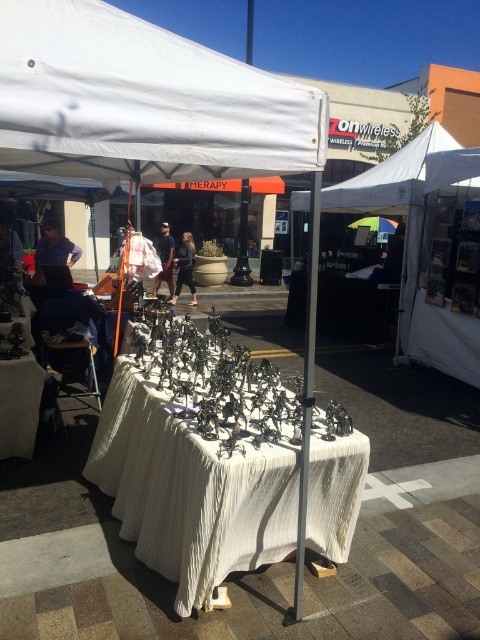
Question: From the image, what is the correct spatial relationship of metallic silver figurines at center in relation to dark gray pants at center?

Choices:
 (A) right
 (B) left

Answer: (A)

Question: Does white fabric tent at upper center come in front of matte blue shirt at left?

Choices:
 (A) no
 (B) yes

Answer: (B)

Question: Considering the relative positions of matte blue shirt at left and dark blue jeans at center in the image provided, where is matte blue shirt at left located with respect to dark blue jeans at center?

Choices:
 (A) right
 (B) left

Answer: (B)

Question: Which point is farther to the camera?

Choices:
 (A) white fabric tent at upper center
 (B) dark blue jeans at center
 (C) white fabric canopy at upper center

Answer: (B)

Question: Which point appears farthest from the camera in this image?

Choices:
 (A) (177, 298)
 (B) (168, 227)
 (C) (417, 240)
 (D) (64, 60)

Answer: (B)

Question: Estimate the real-world distances between objects in this image. Which object is farther from the metallic silver figurines at center?

Choices:
 (A) white fabric canopy at upper center
 (B) matte blue shirt at left
 (C) dark gray pants at center

Answer: (C)